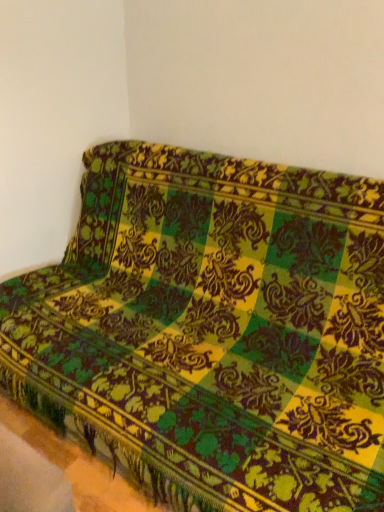
Question: Should I look upward or downward to see velvet green-yellow couch at upper right?

Choices:
 (A) up
 (B) down

Answer: (B)